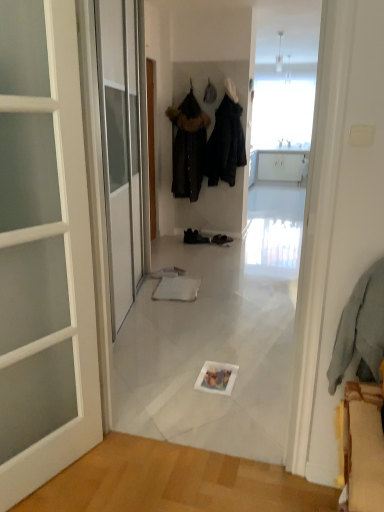
Question: From the image's perspective, relative to light blue fabric at right, which appears as the 3th clothing when viewed from the back, is black leather shoes at center, which is the first footwear from left to right, above or below?

Choices:
 (A) below
 (B) above

Answer: (B)

Question: Visually, is black leather shoes at center, the second footwear when ordered from right to left, positioned to the left or to the right of light blue fabric at right, which appears as the 3th clothing when viewed from the back?

Choices:
 (A) right
 (B) left

Answer: (B)

Question: Which object is positioned closest to the black fabric coat at center, which is counted as the second clothing, starting from the back?

Choices:
 (A) dark brown fur-trimmed coat at center, the 1th clothing positioned from the back
 (B) black leather shoes at center, which ranks as the first footwear in right-to-left order
 (C) black leather shoes at center, which is the first footwear from left to right
 (D) light blue fabric at right, which appears as the 3th clothing when viewed from the back

Answer: (A)

Question: Considering the real-world distances, which object is closest to the dark brown fur-trimmed coat at center, positioned as the third clothing in front-to-back order?

Choices:
 (A) black leather shoes at center, which is the first footwear from left to right
 (B) black leather shoes at center, which appears as the second footwear when viewed from the left
 (C) light blue fabric at right, which appears as the 3th clothing when viewed from the back
 (D) black fabric coat at center, arranged as the second clothing when viewed from the front

Answer: (D)